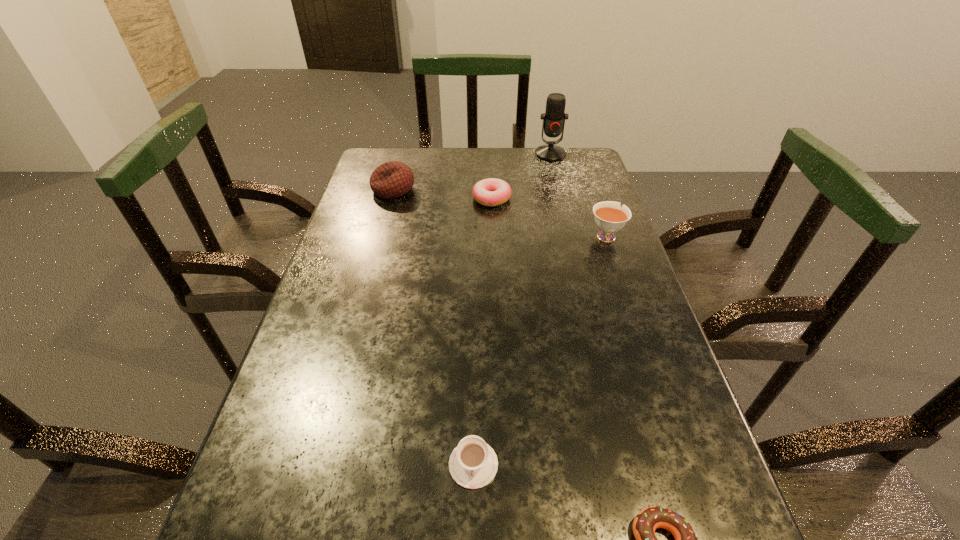
Identify the location of object at the far right corner. The height and width of the screenshot is (540, 960). (554, 117).

I want to click on vacant space at the far edge of the desktop, so click(530, 148).

Image resolution: width=960 pixels, height=540 pixels. In the image, there is a desktop. What are the coordinates of `vacant region at the left edge` in the screenshot? It's located at [x=369, y=367].

Where is `vacant space at the right edge of the desktop`? The width and height of the screenshot is (960, 540). vacant space at the right edge of the desktop is located at coordinates (635, 438).

Identify the location of blank area at the far left corner. (404, 152).

What are the coordinates of `vacant region at the far right corner of the desktop` in the screenshot? It's located at (590, 177).

I want to click on empty space between the microphone and the beanbag, so click(x=472, y=172).

Where is `blank region between the leftmost object and the farthest object`? blank region between the leftmost object and the farthest object is located at coordinates (472, 172).

This screenshot has width=960, height=540. I want to click on empty space that is in between the leftmost object and the nearer teacup, so click(x=433, y=327).

Where is `unoccupied position between the beanbag and the left doughnut`? The height and width of the screenshot is (540, 960). unoccupied position between the beanbag and the left doughnut is located at coordinates (443, 194).